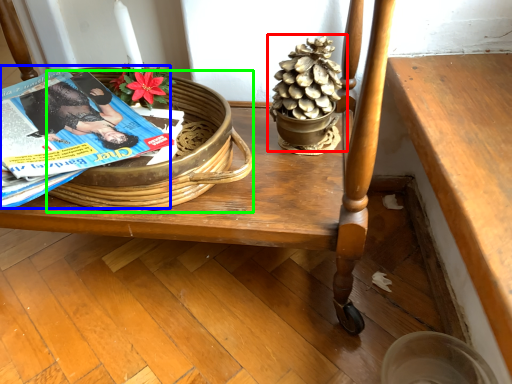
Question: Which is nearer to the houseplant (highlighted by a red box)? magazine (highlighted by a blue box) or basket (highlighted by a green box).

Choices:
 (A) magazine
 (B) basket

Answer: (B)